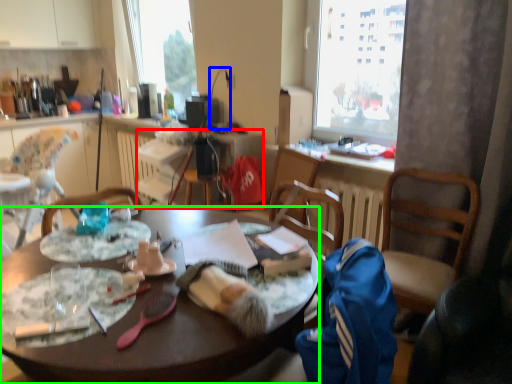
Question: Which object is positioned closest to radiator (highlighted by a red box)? Select from lamp (highlighted by a blue box) and desk (highlighted by a green box).

Choices:
 (A) lamp
 (B) desk

Answer: (A)